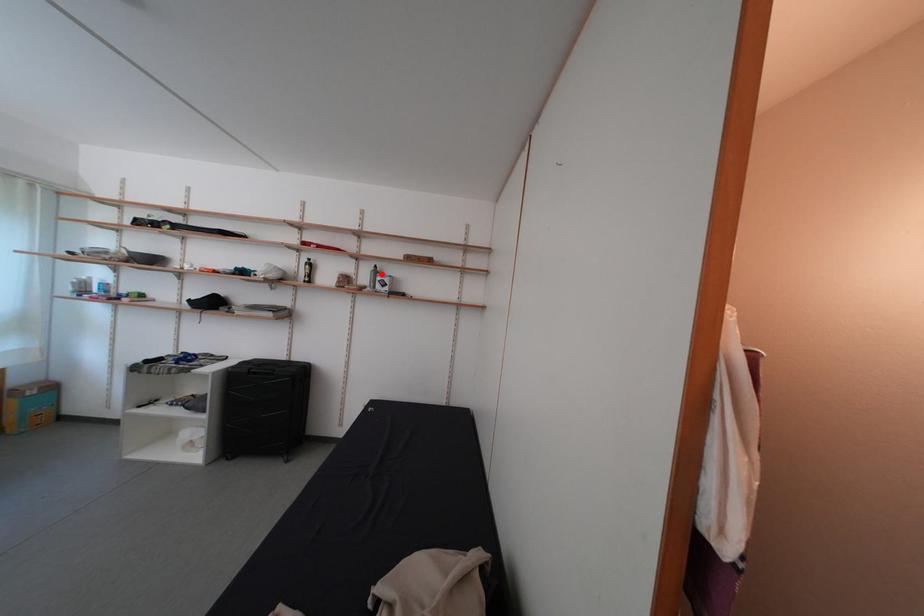
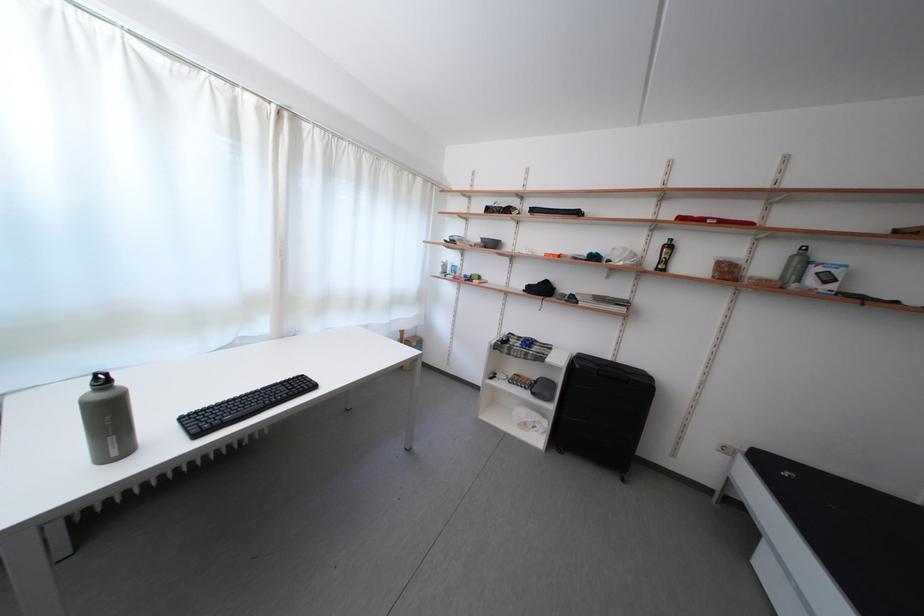
The point at the highlighted location is marked in the first image. Where is the corresponding point in the second image?

(804, 257)